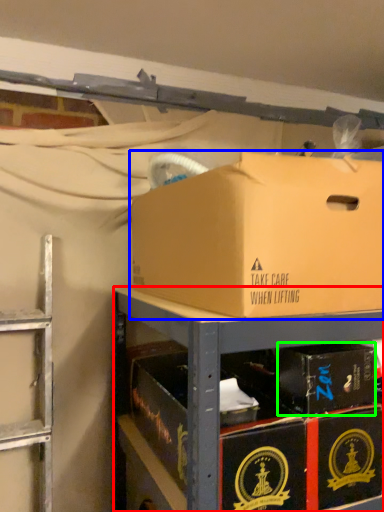
Question: Estimate the real-world distances between objects in this image. Which object is closer to shelf (highlighted by a red box), box (highlighted by a blue box) or box (highlighted by a green box)?

Choices:
 (A) box
 (B) box

Answer: (A)